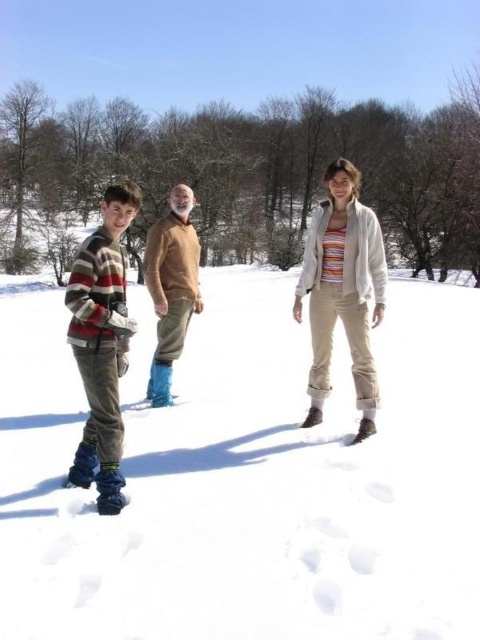
Who is taller, striped sweater at center or striped wool sweater at left?

Standing taller between the two is striped wool sweater at left.

Is point (330, 328) less distant than point (99, 506)?

No, it is behind (99, 506).

I want to click on striped sweater at center, so click(343, 291).

Between striped sweater at center and brown fuzzy sweater at center, which one is positioned lower?

brown fuzzy sweater at center

Is point (323, 273) positioned before point (170, 234)?

That is True.

In order to click on striped sweater at center in this screenshot , I will do `click(343, 291)`.

Between striped wool sweater at left and brown fuzzy sweater at center, which one is positioned higher?

Positioned higher is brown fuzzy sweater at center.

Which is in front, point (83, 477) or point (199, 301)?

Positioned in front is point (83, 477).

Image resolution: width=480 pixels, height=640 pixels. I want to click on striped wool sweater at left, so click(x=101, y=344).